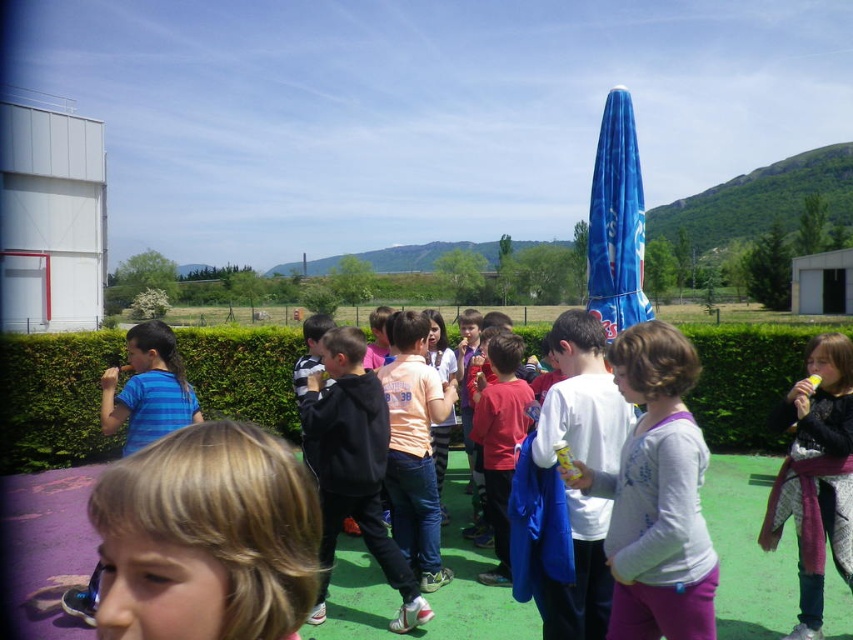
Question: Can you confirm if white cotton shirt at center is thinner than black matte jacket at center?

Choices:
 (A) yes
 (B) no

Answer: (A)

Question: Which point appears closest to the camera in this image?

Choices:
 (A) (486, 500)
 (B) (192, 348)
 (C) (689, 534)

Answer: (C)

Question: Does white matte shirt at center appear over orange cotton shirt at center?

Choices:
 (A) yes
 (B) no

Answer: (A)

Question: Estimate the real-world distances between objects in this image. Which object is closer to the green hedge at center?

Choices:
 (A) red matte shirt at center
 (B) orange cotton shirt at center
 (C) black matte jacket at center
 (D) white cotton shirt at center

Answer: (A)

Question: Which object appears farthest from the camera in this image?

Choices:
 (A) white cotton shirt at center
 (B) red matte shirt at center

Answer: (B)

Question: Can you confirm if green hedge at center is smaller than black knit sweater at right?

Choices:
 (A) no
 (B) yes

Answer: (A)